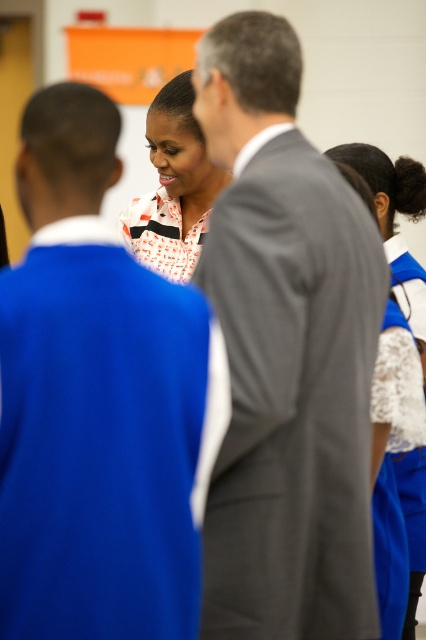
Question: Where is smooth gray suit at center located in relation to gray suit at center in the image?

Choices:
 (A) below
 (B) above

Answer: (A)

Question: Is smooth gray suit at center bigger than gray suit at center?

Choices:
 (A) no
 (B) yes

Answer: (A)

Question: Which point is closer to the camera?

Choices:
 (A) gray suit at center
 (B) white printed blouse at center

Answer: (A)

Question: Which object is farther from the camera taking this photo?

Choices:
 (A) white printed blouse at center
 (B) gray suit at center
 (C) white lace blouse at right

Answer: (A)

Question: Among these points, which one is nearest to the camera?

Choices:
 (A) pyautogui.click(x=62, y=99)
 (B) pyautogui.click(x=284, y=627)
 (C) pyautogui.click(x=167, y=195)
 (D) pyautogui.click(x=362, y=150)

Answer: (A)

Question: Does smooth gray suit at center lie in front of white lace blouse at right?

Choices:
 (A) yes
 (B) no

Answer: (A)